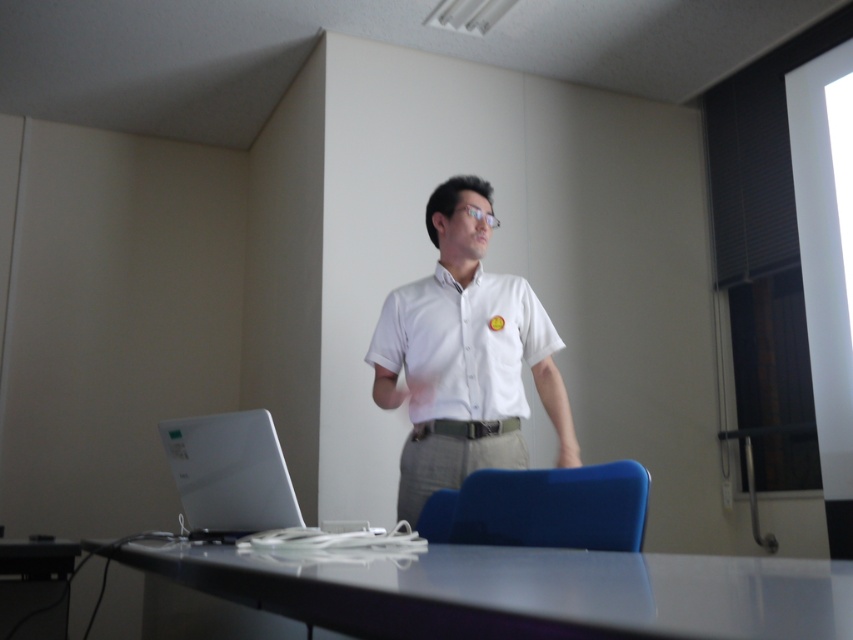
Does white glossy table at lower center have a greater width compared to sleek silver laptop at lower left?

Indeed, white glossy table at lower center has a greater width compared to sleek silver laptop at lower left.

Does white glossy table at lower center have a lesser width compared to sleek silver laptop at lower left?

No, white glossy table at lower center is not thinner than sleek silver laptop at lower left.

Between point (846, 570) and point (199, 454), which one is positioned in front?

Point (846, 570)

At what (x,y) coordinates should I click in order to perform the action: click on white glossy table at lower center. Please return your answer as a coordinate pair (x, y). Looking at the image, I should click on (523, 593).

Is white smooth shirt at center shorter than sleek silver laptop at lower left?

No, white smooth shirt at center is not shorter than sleek silver laptop at lower left.

The height and width of the screenshot is (640, 853). What do you see at coordinates (463, 342) in the screenshot? I see `white smooth shirt at center` at bounding box center [463, 342].

Between point (465, 404) and point (274, 474), which one is positioned behind?

Point (465, 404)

This screenshot has width=853, height=640. I want to click on white smooth shirt at center, so click(x=463, y=342).

Does white glossy table at lower center appear on the left side of white smooth shirt at center?

Correct, you'll find white glossy table at lower center to the left of white smooth shirt at center.

Can you confirm if white glossy table at lower center is positioned to the right of white smooth shirt at center?

No, white glossy table at lower center is not to the right of white smooth shirt at center.

Is point (309, 582) less distant than point (515, 376)?

Yes, it is.

What are the coordinates of `white glossy table at lower center` in the screenshot? It's located at (523, 593).